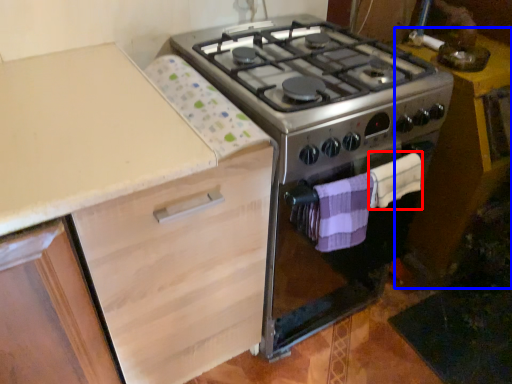
Question: Which point is closer to the camera, blanket (highlighted by a red box) or table (highlighted by a blue box)?

Choices:
 (A) blanket
 (B) table

Answer: (A)